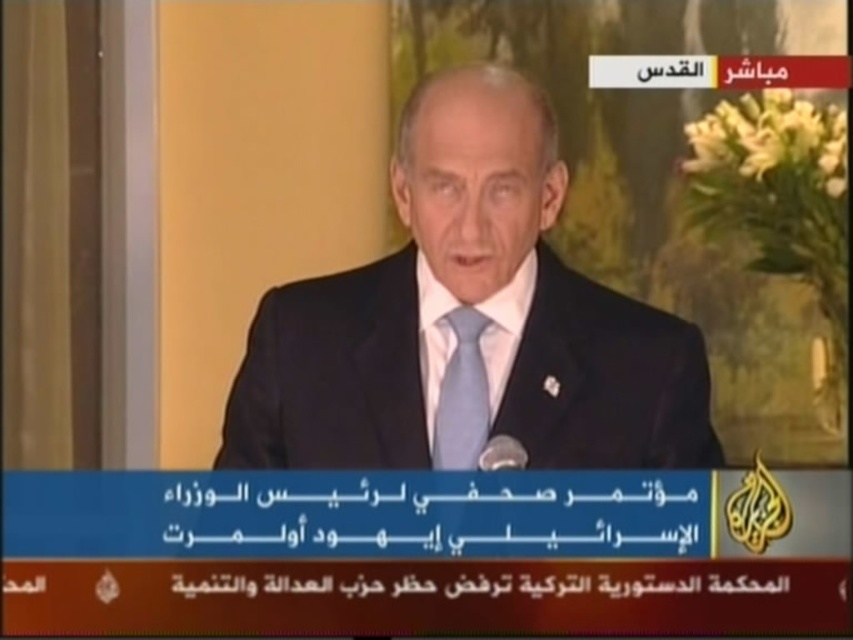
I want to click on dark blue suit at center, so click(474, 308).

Who is shorter, dark blue suit at center or light blue silk tie at center?

light blue silk tie at center

Which is behind, point (292, 292) or point (479, 428)?

Point (292, 292)

You are a GUI agent. You are given a task and a screenshot of the screen. Output one action in this format:
    pyautogui.click(x=<x>, y=<y>)
    Task: Click on the dark blue suit at center
    This screenshot has width=853, height=640.
    Given the screenshot: What is the action you would take?
    pyautogui.click(x=474, y=308)